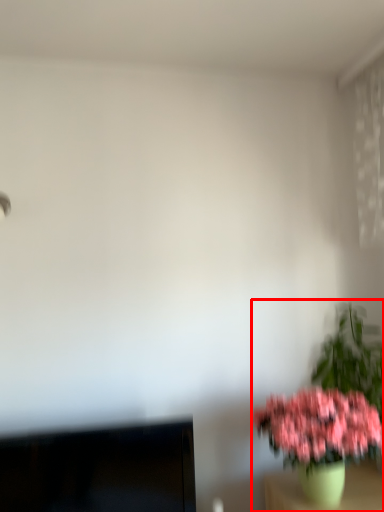
Question: Observing the image, what is the correct spatial positioning of houseplant (annotated by the red box) in reference to computer monitor?

Choices:
 (A) right
 (B) left

Answer: (A)